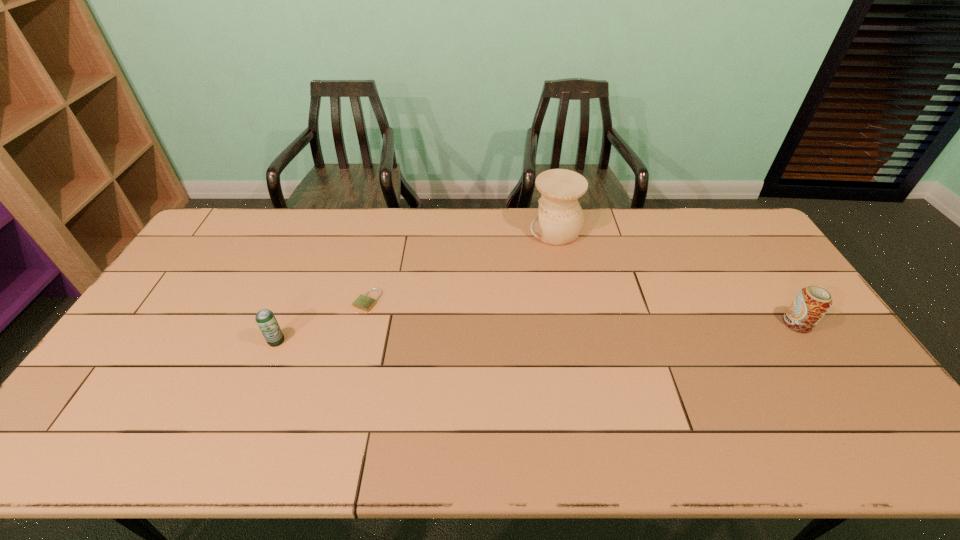
Find the location of `free space between the leftmost object and the tallest object`. free space between the leftmost object and the tallest object is located at coordinates (416, 286).

You are a GUI agent. You are given a task and a screenshot of the screen. Output one action in this format:
    pyautogui.click(x=<x>, y=<y>)
    Task: Click on the object that is the third closest one to the leftmost object
    The image size is (960, 540).
    Given the screenshot: What is the action you would take?
    coord(811,303)

Identify which object is located as the second nearest to the third farthest object. Please provide its 2D coordinates. Your answer should be formatted as a tuple, i.e. [(x, y)], where the tuple contains the x and y coordinates of a point satisfying the conditions above.

[(363, 302)]

Where is `free space that satisfies the following two spatial constraints: 1. at the open side of the farther beer can; 2. on the right side of the farthest object`? free space that satisfies the following two spatial constraints: 1. at the open side of the farther beer can; 2. on the right side of the farthest object is located at coordinates (574, 323).

Where is `free spot that satisfies the following two spatial constraints: 1. at the open side of the tallest object; 2. on the front side of the padlock`? The image size is (960, 540). free spot that satisfies the following two spatial constraints: 1. at the open side of the tallest object; 2. on the front side of the padlock is located at coordinates (569, 300).

Where is `vacant position in the image that satisfies the following two spatial constraints: 1. at the open side of the third object from left to right; 2. on the back side of the rightmost object`? Image resolution: width=960 pixels, height=540 pixels. vacant position in the image that satisfies the following two spatial constraints: 1. at the open side of the third object from left to right; 2. on the back side of the rightmost object is located at coordinates [574, 323].